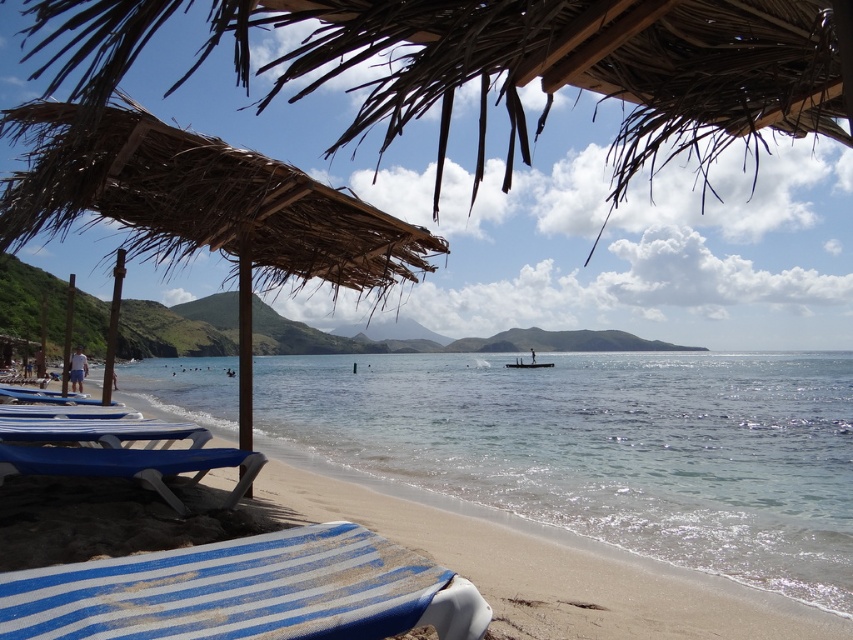
Question: Is blue striped fabric beach chair at lower left positioned in front of blue striped beach chair at lower left?

Choices:
 (A) yes
 (B) no

Answer: (A)

Question: Which object is positioned farthest from the blue striped beach chair at lower left?

Choices:
 (A) thatched straw umbrella at upper left
 (B) blue striped lounge chair at lower left
 (C) wooden canoe at center
 (D) blue plastic beach chair at lower left

Answer: (C)

Question: Among these points, which one is farthest from the camera?

Choices:
 (A) (204, 454)
 (B) (715, 570)
 (C) (138, 412)
 (D) (241, 316)

Answer: (C)

Question: Which object is the farthest from the brown thatched umbrella at upper center?

Choices:
 (A) blue striped beach chair at lower left
 (B) clear blue water at center

Answer: (B)

Question: Is blue striped beach chair at lower left in front of wooden canoe at center?

Choices:
 (A) no
 (B) yes

Answer: (B)

Question: Does thatched straw umbrella at upper left have a smaller size compared to blue plastic beach chair at lower left?

Choices:
 (A) no
 (B) yes

Answer: (A)